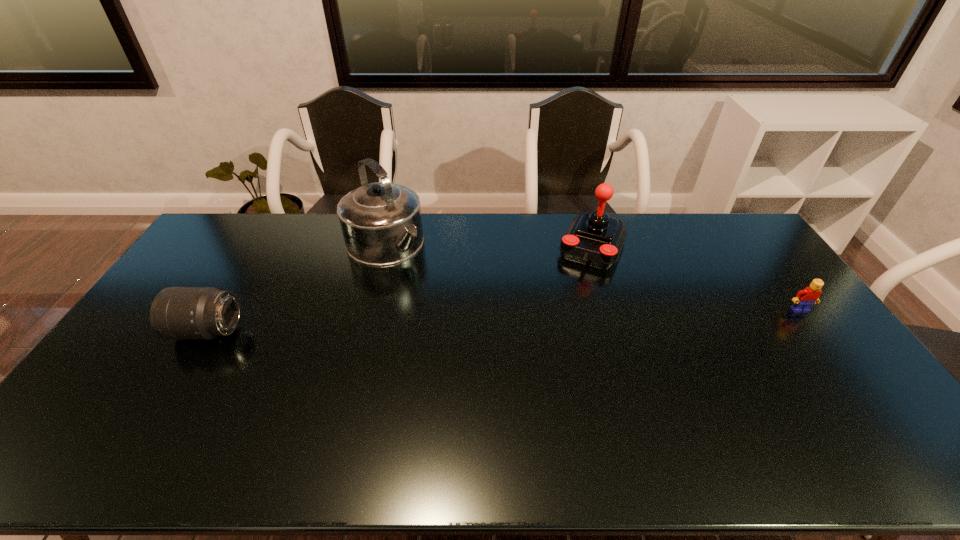
Locate an element on the screen. The height and width of the screenshot is (540, 960). the second shortest object is located at coordinates (177, 313).

Identify the location of telephoto lens. This screenshot has height=540, width=960. (177, 313).

I want to click on the shortest object, so click(804, 299).

This screenshot has width=960, height=540. Find the location of `Lego`. Lego is located at coordinates (804, 299).

Find the location of a particular element. This screenshot has width=960, height=540. the third object from right to left is located at coordinates (381, 223).

Identify the location of kettle. (381, 223).

I want to click on the third object from left to right, so click(596, 239).

The height and width of the screenshot is (540, 960). Find the location of `the third shortest object`. the third shortest object is located at coordinates (596, 239).

I want to click on vacant space situated on the surface of the second shortest object, so click(151, 331).

Locate an element on the screen. The height and width of the screenshot is (540, 960). vacant space located on the face of the rightmost object is located at coordinates (862, 394).